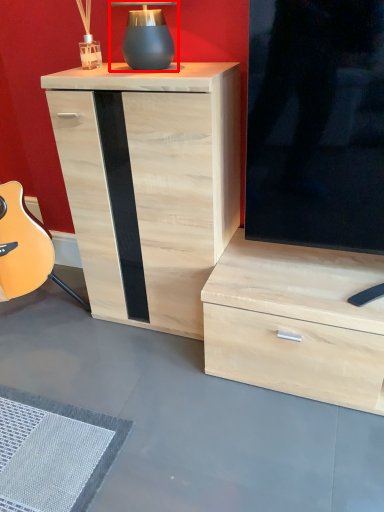
Question: Where is table lamp (annotated by the red box) located in relation to chest of drawers in the image?

Choices:
 (A) right
 (B) left

Answer: (B)